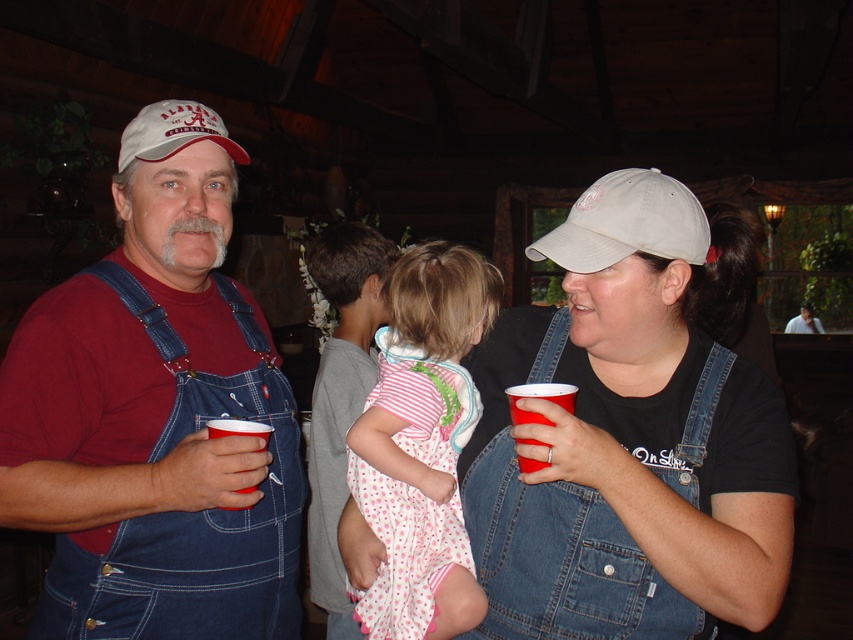
You are a photographer trying to capture a candid shot of the man in the denim overalls at center and the white fabric baseball cap at center. Since you want to ensure both subjects are in focus, you need to know their heights. Which object is taller?

The denim overalls at center is much taller than the white fabric baseball cap at center.

Based on the coordinates provided, which object is positioned at point (x=155, y=417) in the image?

The matte denim overalls at left is located at point (x=155, y=417).

Please provide the 2D coordinates of the denim overalls at center in the image.

The 2D coordinates of the denim overalls at center are at point (x=630, y=435).